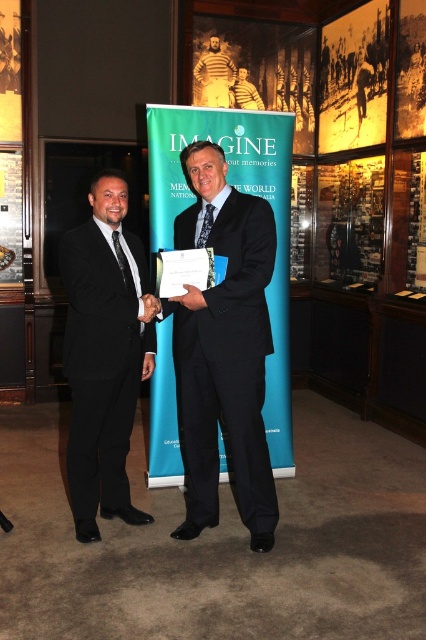
You are a photographer positioned to the side of the two men and the banner. You want to capture a photo where both the black suit at center and the yellow shirt at center are clearly visible. Based on their positions, which object might require you to adjust your angle to ensure it doesn not get obscured by the other?

The yellow shirt at center might be obscured by the black suit at center since the black suit at center is wider and could block part of the yellow shirt at center if not angled properly.

Consider the image. You are a photographer positioned at the entrance of the museum. You need to capture a photo of the black suit at center and the yellow shirt at center such that both are in focus. The camera you are using has a depth of field that can sharply focus on objects within a 3 meter range. Will both subjects be in focus?

The black suit at center is 3.16 meters away from the yellow shirt at center. Since the distance between them exceeds the camera